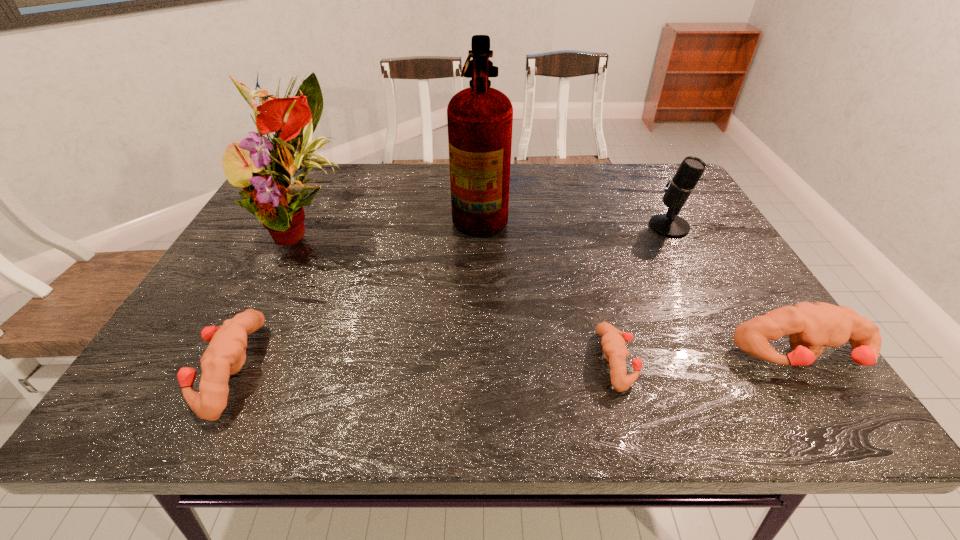
In the image, there is a desktop. Identify the location of vacant space at the far right corner. The width and height of the screenshot is (960, 540). (642, 187).

Identify the location of empty space between the tallest object and the shortest object. (548, 285).

At what (x,y) coordinates should I click in order to perform the action: click on free space between the leftmost puncher and the fire extinguisher. Please return your answer as a coordinate pair (x, y). This screenshot has width=960, height=540. Looking at the image, I should click on (355, 289).

This screenshot has width=960, height=540. I want to click on vacant space in between the fire extinguisher and the rightmost puncher, so click(642, 284).

Identify the location of free spot between the leftmost puncher and the microphone. tap(449, 298).

This screenshot has height=540, width=960. I want to click on free area in between the fourth object from right to left and the rightmost puncher, so click(x=642, y=284).

Where is `vacant area that lies between the rightmost puncher and the fourth object from right to left`? This screenshot has width=960, height=540. vacant area that lies between the rightmost puncher and the fourth object from right to left is located at coordinates (642, 284).

Find the location of a particular element. empty space that is in between the bouquet and the rightmost puncher is located at coordinates (555, 292).

Identify the location of free space between the second shortest puncher and the rightmost puncher. (516, 363).

Locate an element on the screen. Image resolution: width=960 pixels, height=540 pixels. empty location between the second shortest puncher and the rightmost puncher is located at coordinates tap(516, 363).